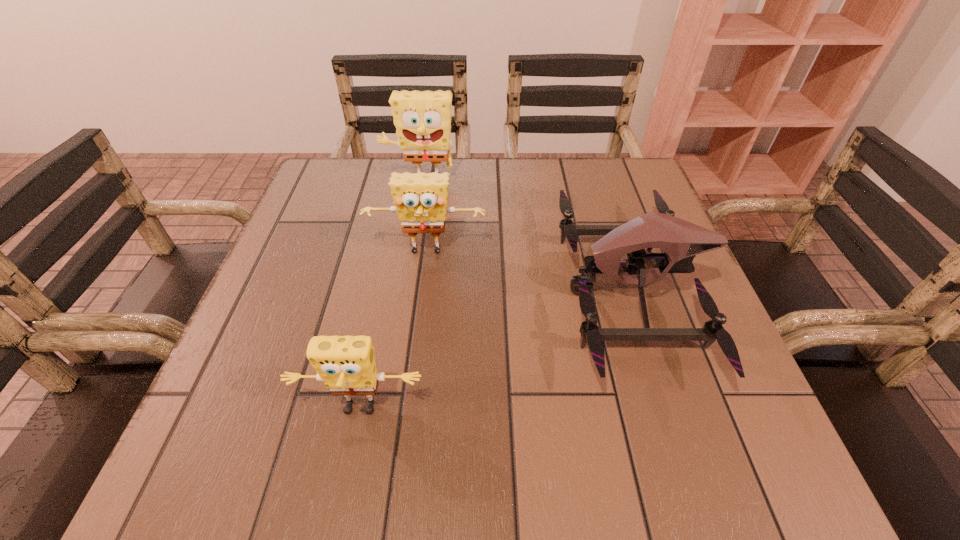
Locate an element on the screen. the tallest object is located at coordinates (422, 119).

This screenshot has width=960, height=540. Identify the location of the farthest object. (422, 119).

Identify the location of the second farthest sponge. Image resolution: width=960 pixels, height=540 pixels. (420, 199).

You are a GUI agent. You are given a task and a screenshot of the screen. Output one action in this format:
    pyautogui.click(x=<x>, y=<y>)
    Task: Click on the drone
    The image size is (960, 540).
    Given the screenshot: What is the action you would take?
    pyautogui.click(x=680, y=240)

Where is `the nearest sponge`? This screenshot has width=960, height=540. the nearest sponge is located at coordinates (346, 364).

At what (x,y) coordinates should I click in order to perform the action: click on free point located 0.200m on the face of the farthest sponge. Please return your answer as a coordinate pair (x, y). The image size is (960, 540). Looking at the image, I should click on (410, 245).

Where is `free space located 0.190m on the face of the second nearest sponge`? This screenshot has height=540, width=960. free space located 0.190m on the face of the second nearest sponge is located at coordinates (416, 340).

You are a GUI agent. You are given a task and a screenshot of the screen. Output one action in this format:
    pyautogui.click(x=<x>, y=<y>)
    Task: Click on the vacant space located on the front-facing side of the rightmost object
    
    Given the screenshot: What is the action you would take?
    pyautogui.click(x=418, y=291)

Where is `blank space located 0.130m on the front-facing side of the rightmost object`? blank space located 0.130m on the front-facing side of the rightmost object is located at coordinates (498, 291).

Identify the location of vacant region located on the front-facing side of the rightmost object. [x=387, y=291].